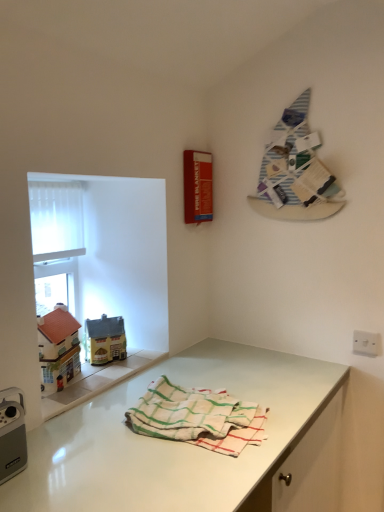
Locate an element on the screen. vacant area on top of white glossy countertop at lower center (from a real-world perspective) is located at coordinates (193, 441).